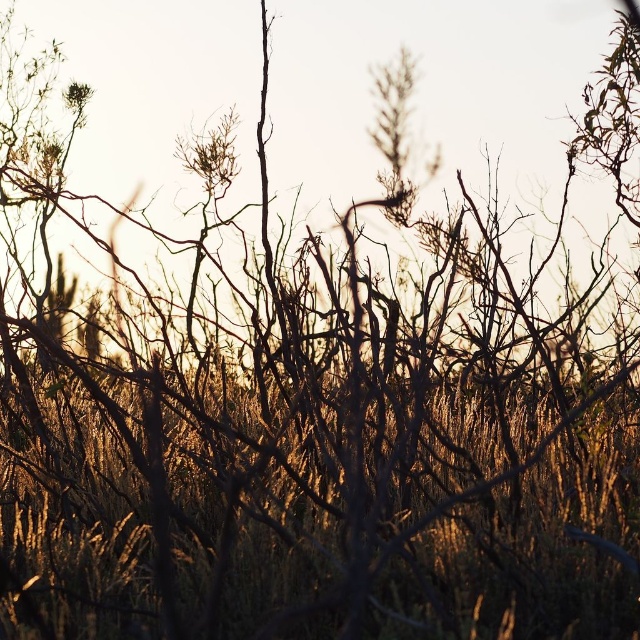
Between brown dry branch at upper center and green matte flower at upper left, which one has more height?

With more height is brown dry branch at upper center.

Which of these two, brown dry branch at upper center or green matte flower at upper left, stands shorter?

With less height is green matte flower at upper left.

The height and width of the screenshot is (640, 640). Find the location of `brown dry branch at upper center`. brown dry branch at upper center is located at coordinates (211, 154).

Which is more to the left, brown dry grass at center or green matte flower at upper left?

green matte flower at upper left is more to the left.

Can you confirm if brown dry grass at center is positioned to the left of green matte flower at upper left?

No, brown dry grass at center is not to the left of green matte flower at upper left.

Is point (564, 628) positioned behind point (84, 97)?

No, (564, 628) is closer to viewer.

At what (x,y) coordinates should I click in order to perform the action: click on brown dry grass at center. Please return your answer as a coordinate pair (x, y). The width and height of the screenshot is (640, 640). Looking at the image, I should click on (520, 528).

Is the position of brown dry grass at center more distant than that of brown dry branch at upper center?

No, brown dry grass at center is closer to the viewer.

Between brown dry grass at center and brown dry branch at upper center, which one has less height?

brown dry grass at center

Which is behind, point (262, 512) or point (214, 182)?

Point (214, 182)

At what (x,y) coordinates should I click in order to perform the action: click on brown dry grass at center. Please return your answer as a coordinate pair (x, y). Looking at the image, I should click on (520, 528).